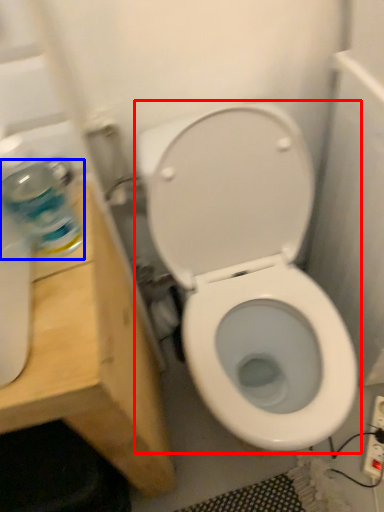
Question: Which point is further to the camera, toilet (highlighted by a red box) or cleaning product (highlighted by a blue box)?

Choices:
 (A) toilet
 (B) cleaning product

Answer: (A)